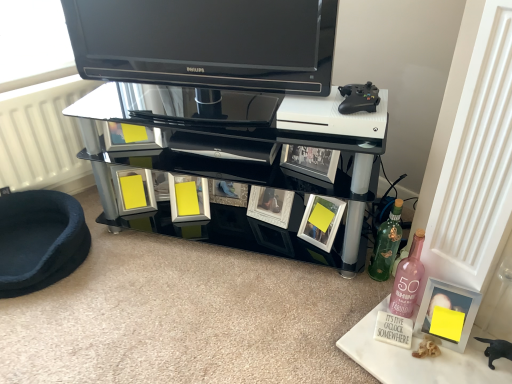
You are a GUI agent. You are given a task and a screenshot of the screen. Output one action in this format:
    pyautogui.click(x=<x>, y=<y>)
    Task: Click on the free space between green glass bottle at lower right, arranged as the first bottle when viewed from the back, and dark blue plush pet bed at lower left
    This screenshot has width=512, height=384.
    Given the screenshot: What is the action you would take?
    pyautogui.click(x=201, y=271)